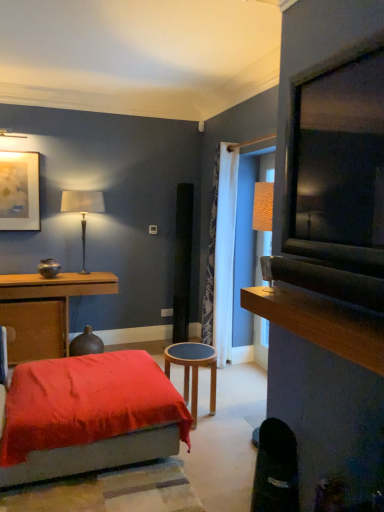
Question: Considering the relative sizes of white textured curtain at center and metallic gold table lamp at upper left in the image provided, is white textured curtain at center wider than metallic gold table lamp at upper left?

Choices:
 (A) yes
 (B) no

Answer: (A)

Question: From a real-world perspective, is white textured curtain at center physically below metallic gold table lamp at upper left?

Choices:
 (A) yes
 (B) no

Answer: (A)

Question: From the image's perspective, does white textured curtain at center appear lower than metallic gold table lamp at upper left?

Choices:
 (A) no
 (B) yes

Answer: (B)

Question: Is white textured curtain at center not near metallic gold table lamp at upper left?

Choices:
 (A) yes
 (B) no

Answer: (A)

Question: Considering the relative sizes of white textured curtain at center and metallic gold table lamp at upper left in the image provided, is white textured curtain at center shorter than metallic gold table lamp at upper left?

Choices:
 (A) no
 (B) yes

Answer: (A)

Question: Considering the positions of wooden table at left, positioned as the 2th table in right-to-left order, and metallic gold table lamp at upper left in the image, is wooden table at left, positioned as the 2th table in right-to-left order, wider or thinner than metallic gold table lamp at upper left?

Choices:
 (A) thin
 (B) wide

Answer: (B)

Question: Is point (49, 287) positioned closer to the camera than point (97, 195)?

Choices:
 (A) farther
 (B) closer

Answer: (B)

Question: From the image's perspective, is wooden table at left, positioned as the 2th table in right-to-left order, above or below metallic gold table lamp at upper left?

Choices:
 (A) below
 (B) above

Answer: (A)

Question: Based on their positions, is wooden table at left, positioned as the 2th table in front-to-back order, located to the left or right of metallic gold table lamp at upper left?

Choices:
 (A) left
 (B) right

Answer: (A)

Question: Is white textured curtain at center taller or shorter than metallic gold table lamp at upper left?

Choices:
 (A) short
 (B) tall

Answer: (B)

Question: Is white textured curtain at center wider or thinner than metallic gold table lamp at upper left?

Choices:
 (A) thin
 (B) wide

Answer: (B)

Question: From the image's perspective, is white textured curtain at center located above or below metallic gold table lamp at upper left?

Choices:
 (A) above
 (B) below

Answer: (B)

Question: Does point (231, 245) appear closer or farther from the camera than point (97, 199)?

Choices:
 (A) closer
 (B) farther

Answer: (A)

Question: Does point (281, 489) appear closer or farther from the camera than point (195, 373)?

Choices:
 (A) farther
 (B) closer

Answer: (B)

Question: From the image's perspective, is black leather swivel chair at lower right positioned above or below wooden stool at center, positioned as the 1th table in right-to-left order?

Choices:
 (A) above
 (B) below

Answer: (B)